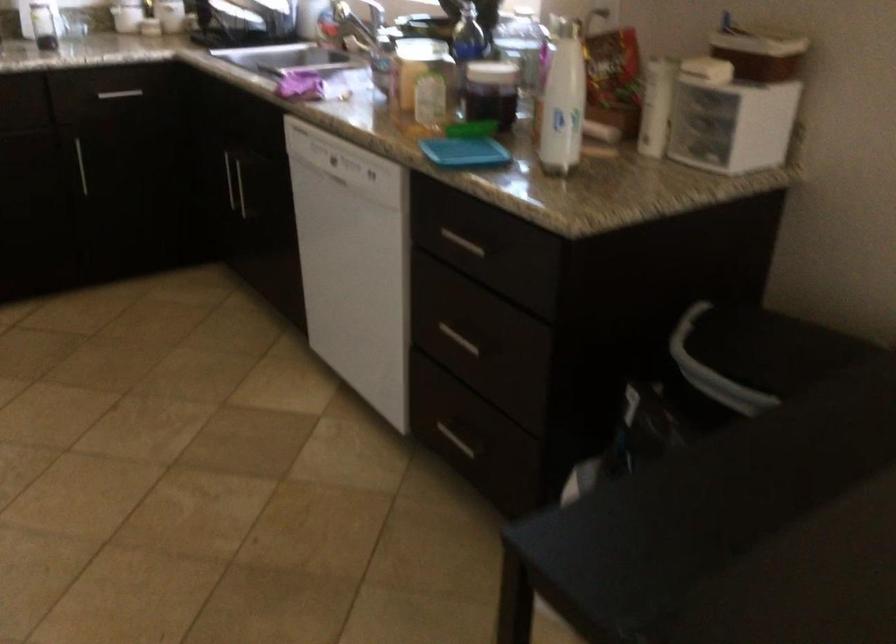
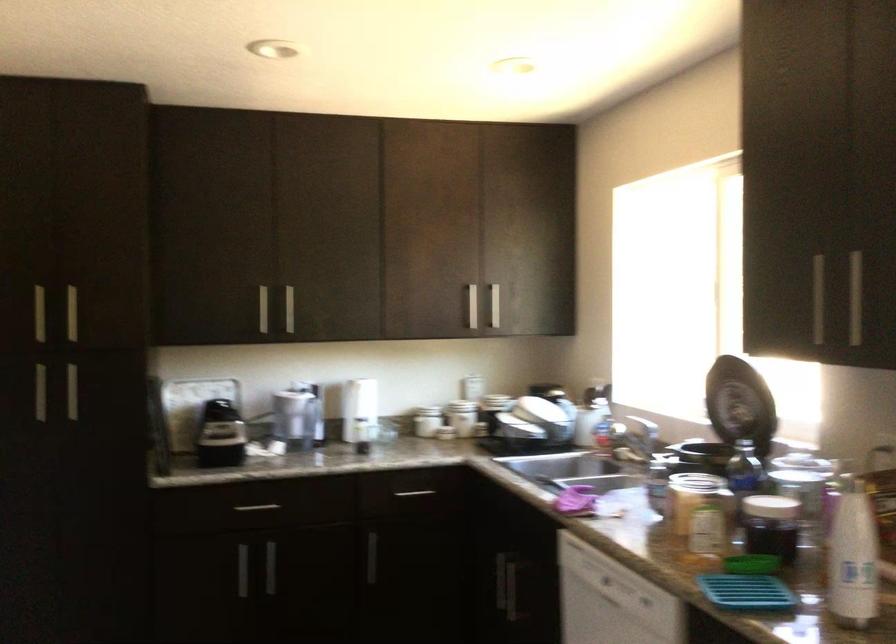
Where in the second image is the point corresponding to the point at 560,106 from the first image?

(853, 556)